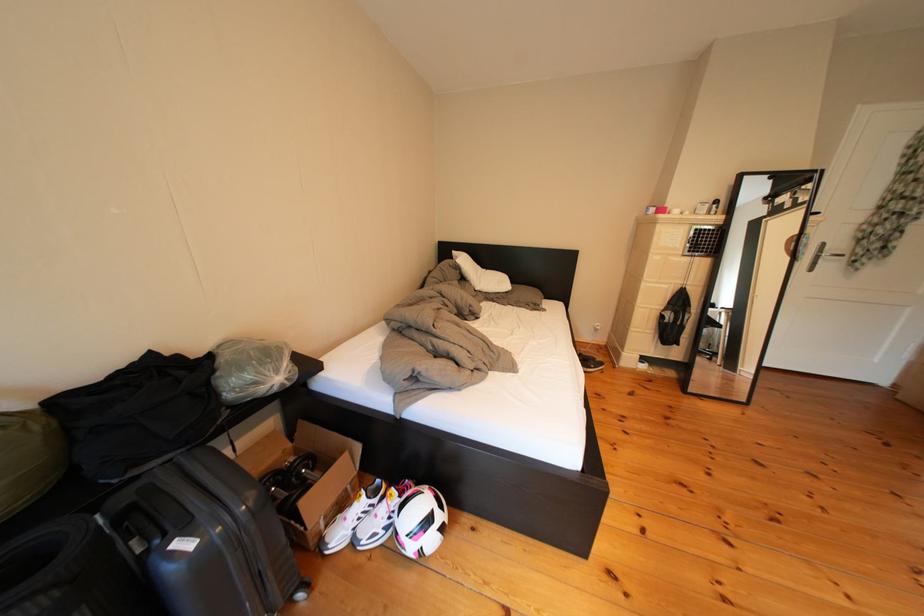
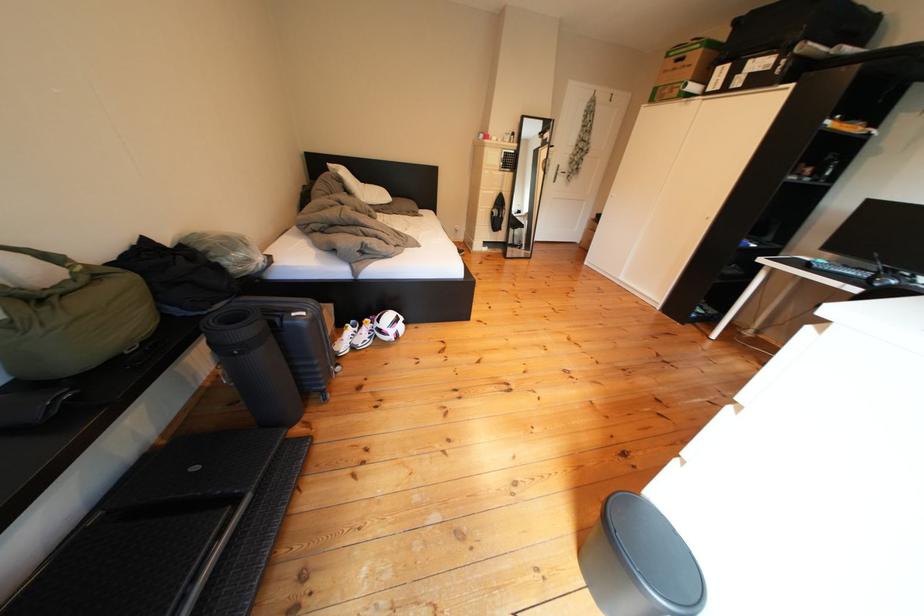
Find the pixel in the second image that matches [390,505] in the first image.

(370, 334)